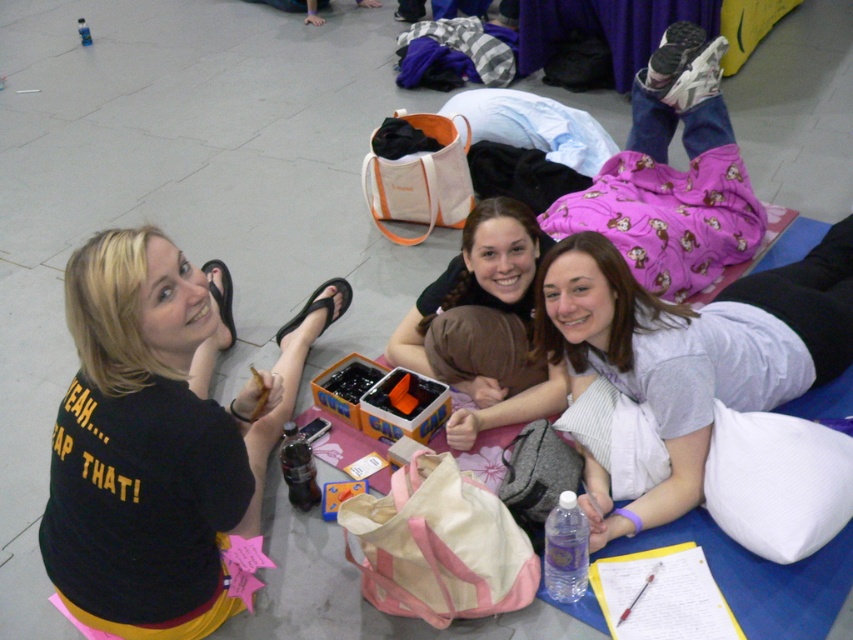
Does light gray cotton shirt at center lie in front of matte black hair at center?

Yes.

Locate an element on the screen. Image resolution: width=853 pixels, height=640 pixels. light gray cotton shirt at center is located at coordinates (703, 394).

Locate an element on the screen. light gray cotton shirt at center is located at coordinates (703, 394).

Who is higher up, black matte shirt at upper left or light gray cotton shirt at center?

light gray cotton shirt at center

Is black matte shirt at upper left above light gray cotton shirt at center?

Incorrect, black matte shirt at upper left is not positioned above light gray cotton shirt at center.

Who is more forward, [73,378] or [699,460]?

Positioned in front is point [73,378].

Locate an element on the screen. The height and width of the screenshot is (640, 853). black matte shirt at upper left is located at coordinates (160, 436).

Does black matte shirt at upper left lie in front of matte black hair at center?

Yes, it is in front of matte black hair at center.

In the scene shown: Which is more to the left, black matte shirt at upper left or matte black hair at center?

black matte shirt at upper left

Image resolution: width=853 pixels, height=640 pixels. Describe the element at coordinates (160, 436) in the screenshot. I see `black matte shirt at upper left` at that location.

Identify the location of black matte shirt at upper left. This screenshot has width=853, height=640. (160, 436).